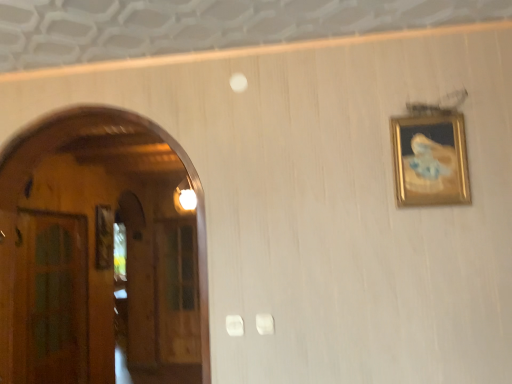
This screenshot has width=512, height=384. What do you see at coordinates (50, 299) in the screenshot? I see `green glass door at left, the first glass door positioned from the front` at bounding box center [50, 299].

What are the coordinates of `green glass door at left, which is the 2th glass door in back-to-front order` in the screenshot? It's located at (50, 299).

Can you tell me how much green glass door at left, positioned as the second glass door in right-to-left order, and transparent wooden door at left, the second glass door in the front-to-back sequence, differ in facing direction?

There is a 93.7-degree angle between the facing directions of green glass door at left, positioned as the second glass door in right-to-left order, and transparent wooden door at left, the second glass door in the front-to-back sequence.

Consider the image. Is green glass door at left, positioned as the second glass door in right-to-left order, directly adjacent to transparent wooden door at left, marked as the 1th glass door in a back-to-front arrangement?

No, green glass door at left, positioned as the second glass door in right-to-left order, is not with transparent wooden door at left, marked as the 1th glass door in a back-to-front arrangement.

Looking at this image, is green glass door at left, placed as the first glass door when sorted from left to right, taller or shorter than transparent wooden door at left, marked as the 1th glass door in a back-to-front arrangement?

green glass door at left, placed as the first glass door when sorted from left to right, is shorter than transparent wooden door at left, marked as the 1th glass door in a back-to-front arrangement.

Which point is more distant from viewer, (56,273) or (158,325)?

The point (158,325) is farther.

From the picture: Can you tell me how much transparent wooden door at left, marked as the 1th glass door in a back-to-front arrangement, and green glass door at left, placed as the first glass door when sorted from left to right, differ in facing direction?

93.7 degrees.

Is transparent wooden door at left, marked as the 1th glass door in a back-to-front arrangement, touching green glass door at left, positioned as the second glass door in right-to-left order?

No, transparent wooden door at left, marked as the 1th glass door in a back-to-front arrangement, is not making contact with green glass door at left, positioned as the second glass door in right-to-left order.

I want to click on glass door on the left of the transparent wooden door at left, arranged as the 1th glass door when viewed from the right, so click(x=50, y=299).

Is transparent wooden door at left, acting as the second glass door starting from the left, oriented towards green glass door at left, positioned as the second glass door in right-to-left order?

Yes, transparent wooden door at left, acting as the second glass door starting from the left, faces towards green glass door at left, positioned as the second glass door in right-to-left order.

Is gold-framed painting at upper right bigger or smaller than transparent wooden door at left, the second glass door in the front-to-back sequence?

Considering their sizes, gold-framed painting at upper right takes up less space than transparent wooden door at left, the second glass door in the front-to-back sequence.

From the image's perspective, is gold-framed painting at upper right under transparent wooden door at left, acting as the second glass door starting from the left?

Incorrect, from the image's perspective, gold-framed painting at upper right is higher than transparent wooden door at left, acting as the second glass door starting from the left.

How many degrees apart are the facing directions of gold-framed painting at upper right and transparent wooden door at left, the second glass door in the front-to-back sequence?

The angle between the facing direction of gold-framed painting at upper right and the facing direction of transparent wooden door at left, the second glass door in the front-to-back sequence, is 0.839 degrees.

Is gold-framed painting at upper right oriented away from transparent wooden door at left, arranged as the 1th glass door when viewed from the right?

gold-framed painting at upper right does not have its back to transparent wooden door at left, arranged as the 1th glass door when viewed from the right.

Is the position of green glass door at left, positioned as the second glass door in right-to-left order, more distant than that of gold-framed painting at upper right?

Yes, it is behind gold-framed painting at upper right.

From the image's perspective, is green glass door at left, which is the 2th glass door in back-to-front order, located beneath gold-framed painting at upper right?

Yes.

Does green glass door at left, the first glass door positioned from the front, appear on the left side of gold-framed painting at upper right?

Correct, you'll find green glass door at left, the first glass door positioned from the front, to the left of gold-framed painting at upper right.

How different are the orientations of green glass door at left, placed as the first glass door when sorted from left to right, and gold-framed painting at upper right in degrees?

The facing directions of green glass door at left, placed as the first glass door when sorted from left to right, and gold-framed painting at upper right are 92.9 degrees apart.

How distant is gold-framed painting at upper right from green glass door at left, positioned as the second glass door in right-to-left order?

gold-framed painting at upper right is 10.85 feet from green glass door at left, positioned as the second glass door in right-to-left order.

Based on their sizes in the image, would you say gold-framed painting at upper right is bigger or smaller than green glass door at left, which is the 2th glass door in back-to-front order?

In the image, gold-framed painting at upper right appears to be smaller than green glass door at left, which is the 2th glass door in back-to-front order.

Who is more distant, gold-framed painting at upper right or green glass door at left, placed as the first glass door when sorted from left to right?

green glass door at left, placed as the first glass door when sorted from left to right, is behind.

How many degrees apart are the facing directions of transparent wooden door at left, the second glass door in the front-to-back sequence, and gold-framed painting at upper right?

There is a 0.839-degree angle between the facing directions of transparent wooden door at left, the second glass door in the front-to-back sequence, and gold-framed painting at upper right.

Does transparent wooden door at left, arranged as the 1th glass door when viewed from the right, turn towards gold-framed painting at upper right?

No, transparent wooden door at left, arranged as the 1th glass door when viewed from the right, is not aimed at gold-framed painting at upper right.

This screenshot has width=512, height=384. Find the location of `picture frame above the transparent wooden door at left, acting as the second glass door starting from the left (from a real-world perspective)`. picture frame above the transparent wooden door at left, acting as the second glass door starting from the left (from a real-world perspective) is located at coordinates click(x=430, y=160).

How far apart are transparent wooden door at left, arranged as the 1th glass door when viewed from the right, and gold-framed painting at upper right?

transparent wooden door at left, arranged as the 1th glass door when viewed from the right, is 4.26 meters from gold-framed painting at upper right.

Where is `glass door directly beneath the green glass door at left, the first glass door positioned from the front (from a real-world perspective)`? The width and height of the screenshot is (512, 384). glass door directly beneath the green glass door at left, the first glass door positioned from the front (from a real-world perspective) is located at coordinates (177, 291).

Identify the location of glass door lying behind the green glass door at left, the first glass door positioned from the front. (177, 291).

Considering their positions, is green glass door at left, the first glass door positioned from the front, positioned closer to gold-framed painting at upper right than transparent wooden door at left, arranged as the 1th glass door when viewed from the right?

green glass door at left, the first glass door positioned from the front, is positioned closer to the anchor gold-framed painting at upper right.

Estimate the real-world distances between objects in this image. Which object is closer to transparent wooden door at left, the second glass door in the front-to-back sequence, gold-framed painting at upper right or green glass door at left, the first glass door positioned from the front?

green glass door at left, the first glass door positioned from the front, is positioned closer to the anchor transparent wooden door at left, the second glass door in the front-to-back sequence.

Based on their spatial positions, is gold-framed painting at upper right or transparent wooden door at left, the second glass door in the front-to-back sequence, closer to green glass door at left, which is the 2th glass door in back-to-front order?

transparent wooden door at left, the second glass door in the front-to-back sequence, lies closer to green glass door at left, which is the 2th glass door in back-to-front order, than the other object.

Estimate the real-world distances between objects in this image. Which object is further from gold-framed painting at upper right, transparent wooden door at left, arranged as the 1th glass door when viewed from the right, or green glass door at left, the first glass door positioned from the front?

The object further to gold-framed painting at upper right is transparent wooden door at left, arranged as the 1th glass door when viewed from the right.

From the picture: Estimate the real-world distances between objects in this image. Which object is closer to transparent wooden door at left, marked as the 1th glass door in a back-to-front arrangement, green glass door at left, which is the 2th glass door in back-to-front order, or gold-framed painting at upper right?

green glass door at left, which is the 2th glass door in back-to-front order, lies closer to transparent wooden door at left, marked as the 1th glass door in a back-to-front arrangement, than the other object.

From the image, which object appears to be nearer to green glass door at left, positioned as the second glass door in right-to-left order, transparent wooden door at left, marked as the 1th glass door in a back-to-front arrangement, or gold-framed painting at upper right?

The object closer to green glass door at left, positioned as the second glass door in right-to-left order, is transparent wooden door at left, marked as the 1th glass door in a back-to-front arrangement.

The height and width of the screenshot is (384, 512). I want to click on glass door between gold-framed painting at upper right and transparent wooden door at left, marked as the 1th glass door in a back-to-front arrangement, in the front-back direction, so click(x=50, y=299).